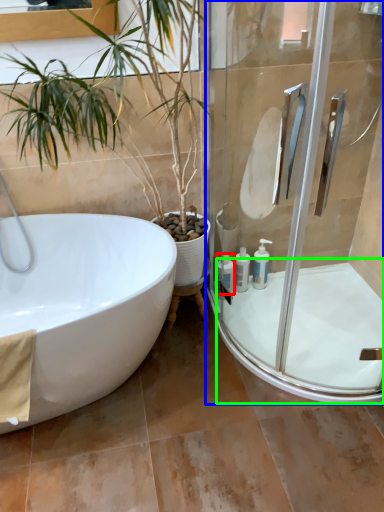
Question: Which is nearer to the toiletry (highlighted by a red box)? shower door (highlighted by a blue box) or bath (highlighted by a green box).

Choices:
 (A) shower door
 (B) bath

Answer: (B)